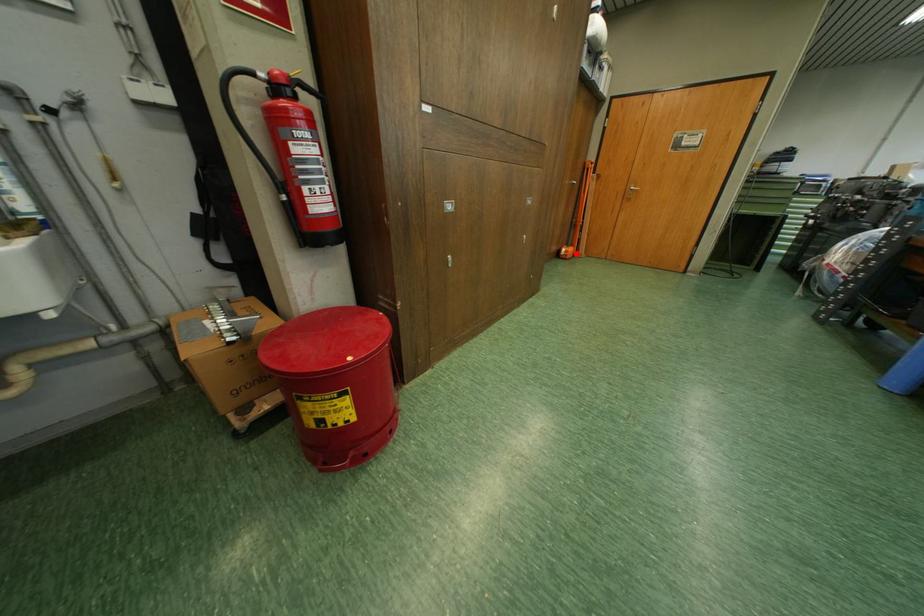
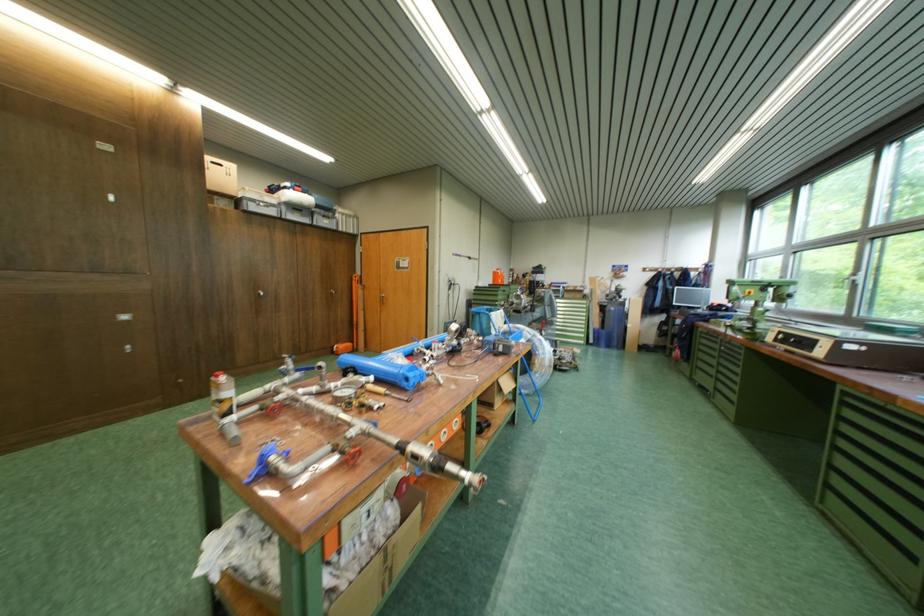
The point at the highlighted location is marked in the first image. Where is the corresponding point in the second image?

(347, 350)